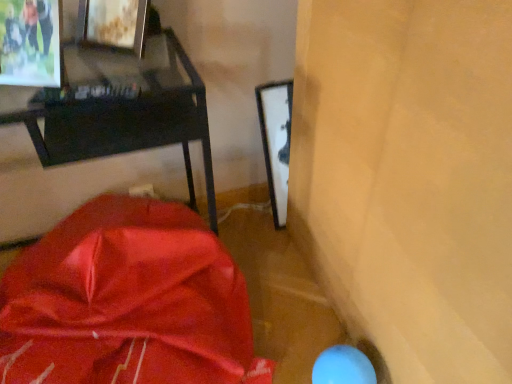
Question: In terms of width, does matte black desk at upper left look wider or thinner when compared to metallic silver picture frame at upper left?

Choices:
 (A) wide
 (B) thin

Answer: (A)

Question: In terms of height, does matte black desk at upper left look taller or shorter compared to metallic silver picture frame at upper left?

Choices:
 (A) short
 (B) tall

Answer: (B)

Question: Based on their relative distances, which object is farther from the matte black desk at upper left?

Choices:
 (A) satin red blanket at lower left
 (B) metallic silver picture frame at upper left

Answer: (A)

Question: Which of these objects is positioned farthest from the matte black desk at upper left?

Choices:
 (A) satin red blanket at lower left
 (B) metallic silver picture frame at upper left

Answer: (A)